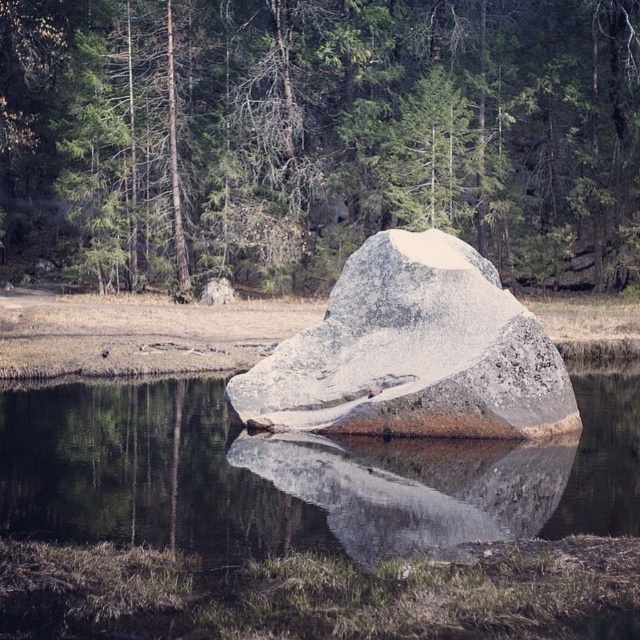
You are standing at the origin point in the image and want to reach the point labeled point (275, 480). There is an obstacle at point (387, 81). Will you be able to see the target point without the obstacle blocking your view?

Point (387, 81) is behind point (275, 480), so the obstacle at point (387, 81) will not block your view of the target point (275, 480).

You are standing at the edge of the water and see the green textured rock at center and the smooth gray rock at center. Which rock would you need to look up to see?

The green textured rock at center is taller than the smooth gray rock at center, so you would need to look up to see the green textured rock at center.